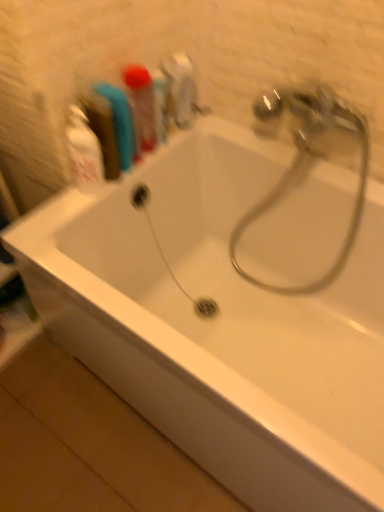
Measure the distance between point [73,111] and camera.

The depth of point [73,111] is 36.18 inches.

The image size is (384, 512). Describe the element at coordinates (84, 152) in the screenshot. I see `white glossy bottle at upper left` at that location.

Measure the distance between point (x=116, y=103) and camera.

Point (x=116, y=103) is 36.85 inches from camera.

At what (x,y) coordinates should I click in order to perform the action: click on translucent plastic toothbrush at upper left, which is the second toiletry in left-to-right order. Please return your answer as a coordinate pair (x, y). This screenshot has height=512, width=384. Looking at the image, I should click on (141, 106).

How much space does translucent plastic toothbrush at upper left, which is the second toiletry in left-to-right order, occupy horizontally?

It is 3.00 inches.

Locate an element on the screen. This screenshot has width=384, height=512. white glossy bottle at upper left is located at coordinates (84, 152).

Does polished chrome tap at upper right come in front of white glossy bottle at upper left?

Yes, polished chrome tap at upper right is closer to the viewer.

Does polished chrome tap at upper right have a lesser height compared to white glossy bottle at upper left?

In fact, polished chrome tap at upper right may be taller than white glossy bottle at upper left.

Is polished chrome tap at upper right facing towards white glossy bottle at upper left?

No, polished chrome tap at upper right does not turn towards white glossy bottle at upper left.

Considering the sizes of objects polished chrome tap at upper right and white glossy bottle at upper left in the image provided, who is wider, polished chrome tap at upper right or white glossy bottle at upper left?

polished chrome tap at upper right.

Is the depth of white glossy bottle at upper left less than that of blue rubber toothbrush at upper left, which is the first toiletry in left-to-right order?

Yes, it is.

How distant is white glossy bottle at upper left from blue rubber toothbrush at upper left, which is counted as the 2th toiletry, starting from the right?

The distance of white glossy bottle at upper left from blue rubber toothbrush at upper left, which is counted as the 2th toiletry, starting from the right, is 8.59 centimeters.

How different are the orientations of white glossy bottle at upper left and blue rubber toothbrush at upper left, which is counted as the 2th toiletry, starting from the right, in degrees?

There is a 35.4-degree angle between the facing directions of white glossy bottle at upper left and blue rubber toothbrush at upper left, which is counted as the 2th toiletry, starting from the right.

Is white glossy bottle at upper left completely or partially outside of blue rubber toothbrush at upper left, which is the first toiletry in left-to-right order?

Yes, white glossy bottle at upper left is not within blue rubber toothbrush at upper left, which is the first toiletry in left-to-right order.

Based on the photo, does blue rubber toothbrush at upper left, which is the first toiletry in left-to-right order, have a lesser width compared to translucent plastic toothbrush at upper left, acting as the first toiletry starting from the right?

No.

From the image's perspective, does blue rubber toothbrush at upper left, which is the first toiletry in left-to-right order, appear lower than translucent plastic toothbrush at upper left, which is the second toiletry in left-to-right order?

Correct, blue rubber toothbrush at upper left, which is the first toiletry in left-to-right order, appears lower than translucent plastic toothbrush at upper left, which is the second toiletry in left-to-right order, in the image.

Is there a large distance between blue rubber toothbrush at upper left, which is the first toiletry in left-to-right order, and translucent plastic toothbrush at upper left, acting as the first toiletry starting from the right?

They are positioned close to each other.

Which point is more distant from viewer, (103, 85) or (147, 113)?

Point (147, 113)

Is white glossy bottle at upper left located within blue rubber toothbrush at upper left, which is counted as the 2th toiletry, starting from the right?

That's incorrect, white glossy bottle at upper left is not inside blue rubber toothbrush at upper left, which is counted as the 2th toiletry, starting from the right.

From a real-world perspective, relative to white glossy bottle at upper left, is blue rubber toothbrush at upper left, which is counted as the 2th toiletry, starting from the right, vertically above or below?

From a real-world perspective, blue rubber toothbrush at upper left, which is counted as the 2th toiletry, starting from the right, is physically below white glossy bottle at upper left.

Does blue rubber toothbrush at upper left, which is the first toiletry in left-to-right order, lie in front of white glossy bottle at upper left?

That is False.

How distant is blue rubber toothbrush at upper left, which is the first toiletry in left-to-right order, from white glossy bottle at upper left?

blue rubber toothbrush at upper left, which is the first toiletry in left-to-right order, is 3.38 inches away from white glossy bottle at upper left.

Is polished chrome tap at upper right thinner than blue rubber toothbrush at upper left, which is counted as the 2th toiletry, starting from the right?

No, polished chrome tap at upper right is not thinner than blue rubber toothbrush at upper left, which is counted as the 2th toiletry, starting from the right.

Consider the image. From the image's perspective, which is above, polished chrome tap at upper right or blue rubber toothbrush at upper left, which is the first toiletry in left-to-right order?

blue rubber toothbrush at upper left, which is the first toiletry in left-to-right order, from the image's perspective.

Based on the photo, considering the positions of objects polished chrome tap at upper right and blue rubber toothbrush at upper left, which is the first toiletry in left-to-right order, in the image provided, who is behind, polished chrome tap at upper right or blue rubber toothbrush at upper left, which is the first toiletry in left-to-right order,?

blue rubber toothbrush at upper left, which is the first toiletry in left-to-right order.

Which object is positioned more to the right, blue rubber toothbrush at upper left, which is the first toiletry in left-to-right order, or polished chrome tap at upper right?

polished chrome tap at upper right is more to the right.

From the picture: How many degrees apart are the facing directions of blue rubber toothbrush at upper left, which is the first toiletry in left-to-right order, and polished chrome tap at upper right?

The angular difference between blue rubber toothbrush at upper left, which is the first toiletry in left-to-right order, and polished chrome tap at upper right is 90.5 degrees.

Identify the location of tap that is on the right side of blue rubber toothbrush at upper left, which is the first toiletry in left-to-right order. The height and width of the screenshot is (512, 384). (310, 162).

Considering the sizes of blue rubber toothbrush at upper left, which is counted as the 2th toiletry, starting from the right, and polished chrome tap at upper right in the image, is blue rubber toothbrush at upper left, which is counted as the 2th toiletry, starting from the right, taller or shorter than polished chrome tap at upper right?

Considering their sizes, blue rubber toothbrush at upper left, which is counted as the 2th toiletry, starting from the right, has less height than polished chrome tap at upper right.

Starting from the polished chrome tap at upper right, which toiletry is the 1st one to the left? Please provide its 2D coordinates.

[(141, 106)]

From a real-world perspective, is polished chrome tap at upper right physically located above or below translucent plastic toothbrush at upper left, which is the second toiletry in left-to-right order?

polished chrome tap at upper right is below translucent plastic toothbrush at upper left, which is the second toiletry in left-to-right order.

Could you tell me if polished chrome tap at upper right is facing translucent plastic toothbrush at upper left, acting as the first toiletry starting from the right?

No.

Which is in front, polished chrome tap at upper right or translucent plastic toothbrush at upper left, which is the second toiletry in left-to-right order?

polished chrome tap at upper right.

Image resolution: width=384 pixels, height=512 pixels. Find the location of `cleaning product behind the polished chrome tap at upper right`. cleaning product behind the polished chrome tap at upper right is located at coordinates (84, 152).

Where is `cleaning product above the blue rubber toothbrush at upper left, which is counted as the 2th toiletry, starting from the right (from a real-world perspective)`? This screenshot has width=384, height=512. cleaning product above the blue rubber toothbrush at upper left, which is counted as the 2th toiletry, starting from the right (from a real-world perspective) is located at coordinates (84, 152).

When comparing their distances from translucent plastic toothbrush at upper left, acting as the first toiletry starting from the right, does blue rubber toothbrush at upper left, which is the first toiletry in left-to-right order, or white glossy bottle at upper left seem closer?

blue rubber toothbrush at upper left, which is the first toiletry in left-to-right order, is closer to translucent plastic toothbrush at upper left, acting as the first toiletry starting from the right.

Estimate the real-world distances between objects in this image. Which object is closer to white glossy bottle at upper left, translucent plastic toothbrush at upper left, acting as the first toiletry starting from the right, or blue rubber toothbrush at upper left, which is counted as the 2th toiletry, starting from the right?

blue rubber toothbrush at upper left, which is counted as the 2th toiletry, starting from the right, is closer to white glossy bottle at upper left.

When comparing their distances from white glossy bottle at upper left, does polished chrome tap at upper right or translucent plastic toothbrush at upper left, which is the second toiletry in left-to-right order, seem further?

Among the two, polished chrome tap at upper right is located further to white glossy bottle at upper left.

Considering their positions, is translucent plastic toothbrush at upper left, acting as the first toiletry starting from the right, positioned closer to polished chrome tap at upper right than blue rubber toothbrush at upper left, which is the first toiletry in left-to-right order?

translucent plastic toothbrush at upper left, acting as the first toiletry starting from the right, is closer to polished chrome tap at upper right.

Which object lies nearer to the anchor point polished chrome tap at upper right, blue rubber toothbrush at upper left, which is the first toiletry in left-to-right order, or translucent plastic toothbrush at upper left, which is the second toiletry in left-to-right order?

translucent plastic toothbrush at upper left, which is the second toiletry in left-to-right order, lies closer to polished chrome tap at upper right than the other object.

Estimate the real-world distances between objects in this image. Which object is further from blue rubber toothbrush at upper left, which is the first toiletry in left-to-right order, white glossy bottle at upper left or polished chrome tap at upper right?

polished chrome tap at upper right is further to blue rubber toothbrush at upper left, which is the first toiletry in left-to-right order.

Based on their spatial positions, is blue rubber toothbrush at upper left, which is the first toiletry in left-to-right order, or polished chrome tap at upper right closer to translucent plastic toothbrush at upper left, which is the second toiletry in left-to-right order?

blue rubber toothbrush at upper left, which is the first toiletry in left-to-right order.

Looking at the image, which one is located further to blue rubber toothbrush at upper left, which is the first toiletry in left-to-right order, translucent plastic toothbrush at upper left, which is the second toiletry in left-to-right order, or polished chrome tap at upper right?

The object further to blue rubber toothbrush at upper left, which is the first toiletry in left-to-right order, is polished chrome tap at upper right.

I want to click on toiletry between translucent plastic toothbrush at upper left, acting as the first toiletry starting from the right, and white glossy bottle at upper left from top to bottom, so click(119, 122).

Identify the location of toiletry between blue rubber toothbrush at upper left, which is the first toiletry in left-to-right order, and polished chrome tap at upper right. (141, 106).